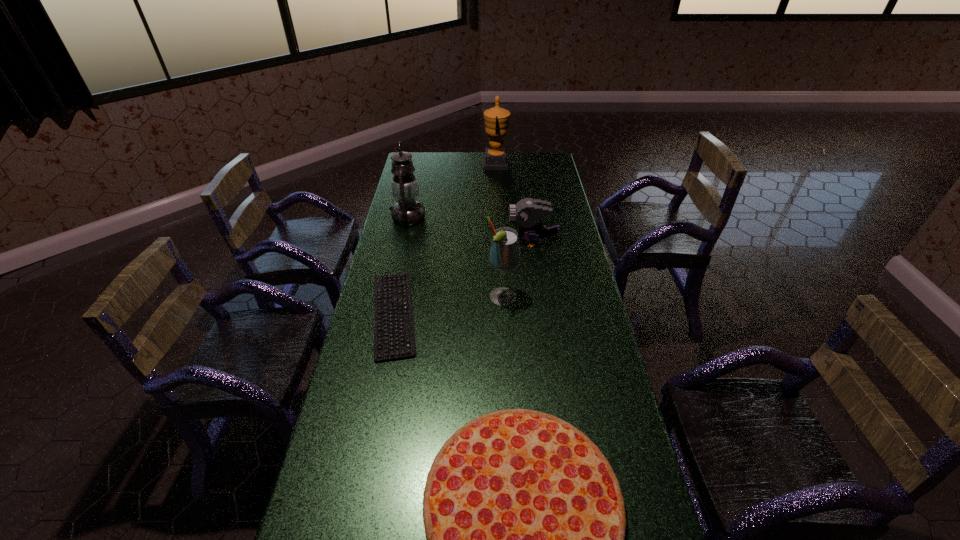
This screenshot has height=540, width=960. Identify the location of free space at the right edge of the desktop. (564, 375).

Where is `blank space at the far right corner of the desktop`? blank space at the far right corner of the desktop is located at coordinates (530, 167).

This screenshot has width=960, height=540. What are the coordinates of `free spot between the alcohol and the fifth nearest object` in the screenshot? It's located at (455, 258).

Where is `free point between the fifth nearest object and the alcohol`? The image size is (960, 540). free point between the fifth nearest object and the alcohol is located at coordinates (455, 258).

Image resolution: width=960 pixels, height=540 pixels. What are the coordinates of `free space between the fourth tallest object and the second farthest object` in the screenshot? It's located at (470, 230).

Where is `the closest object to the fourth nearest object`? the closest object to the fourth nearest object is located at coordinates (504, 255).

The image size is (960, 540). Find the location of `object that is the third closest to the pizza`. object that is the third closest to the pizza is located at coordinates (527, 212).

You are a GUI agent. You are given a task and a screenshot of the screen. Output one action in this format:
    pyautogui.click(x=<x>, y=<y>)
    Task: Click on the free spot that satisfies the following two spatial constraints: 1. at the front of the award with handles; 2. on the front side of the computer keyboard
    Image resolution: width=960 pixels, height=540 pixels.
    Given the screenshot: What is the action you would take?
    pos(504,314)